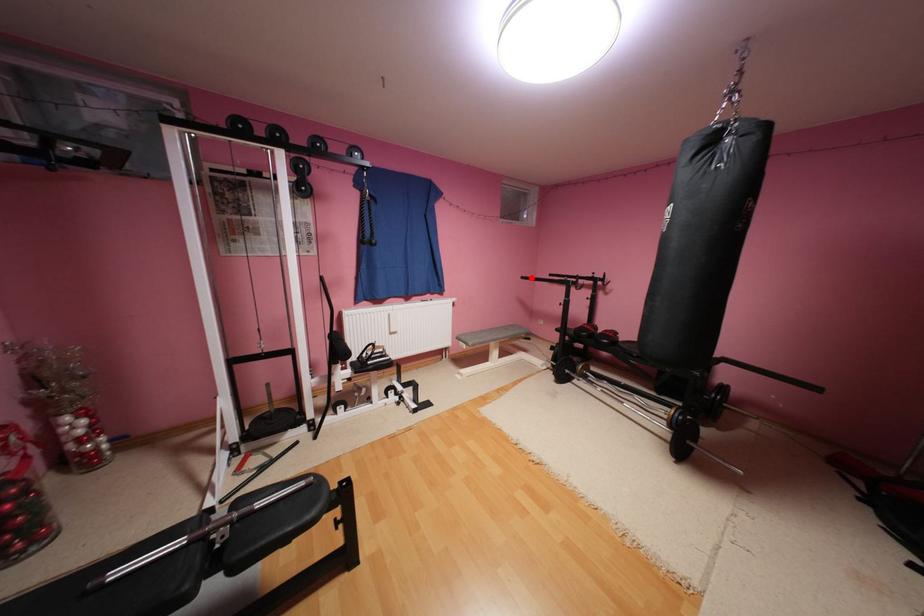
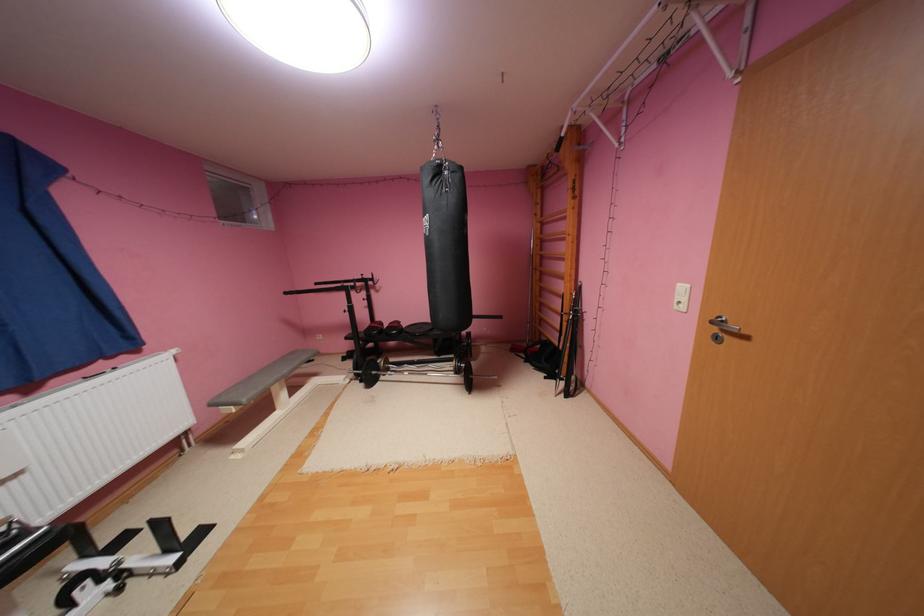
Question: I am providing you with two images of the same scene from different viewpoints. Image1 has a red point marked. In image2, the corresponding 3D location appears at what relative position? Reply with the corresponding letter.

Choices:
 (A) Closer
 (B) Farther

Answer: (A)